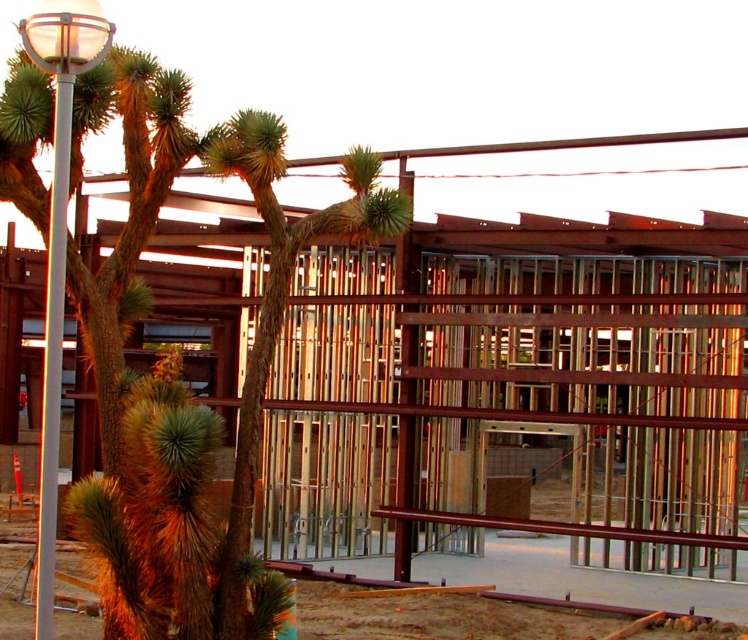
Question: Which point is closer to the camera?

Choices:
 (A) (88, 54)
 (B) (52, 266)

Answer: (B)

Question: Which is nearer to the green spiky palm tree at center?

Choices:
 (A) white glossy lamp post at left
 (B) white glossy pole at left

Answer: (A)

Question: Can you confirm if green spiky palm tree at center is wider than white glossy lamp post at left?

Choices:
 (A) no
 (B) yes

Answer: (B)

Question: Does green spiky palm tree at center appear under white glossy lamp post at left?

Choices:
 (A) yes
 (B) no

Answer: (A)

Question: Is green spiky palm tree at center to the left of white glossy lamp post at left from the viewer's perspective?

Choices:
 (A) no
 (B) yes

Answer: (A)

Question: Which object is positioned farthest from the white glossy lamp post at left?

Choices:
 (A) green spiky palm tree at center
 (B) white glossy pole at left

Answer: (A)